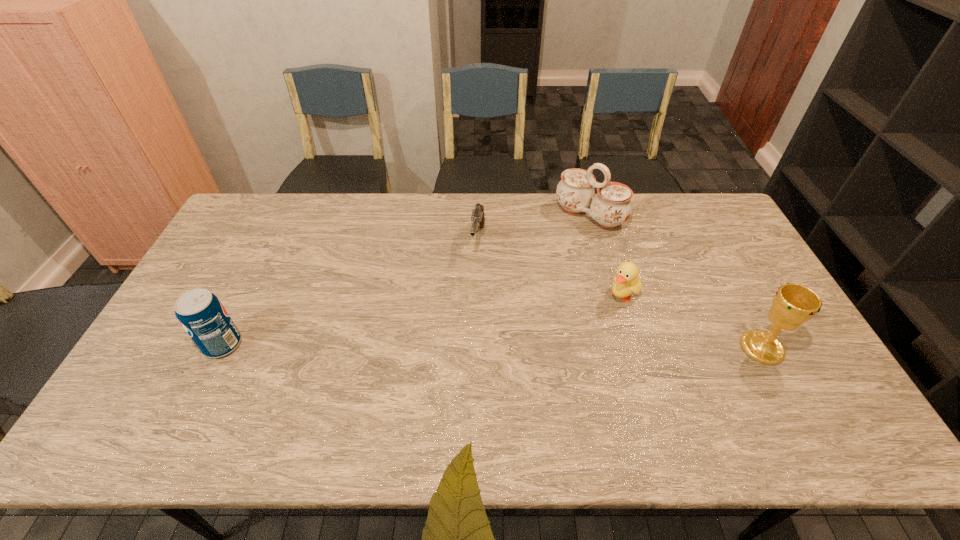
I want to click on free space located on the front-facing side of the third nearest object, so click(x=552, y=364).

Where is `free spot located by the handle of the chinaware`? The width and height of the screenshot is (960, 540). free spot located by the handle of the chinaware is located at coordinates (545, 260).

I want to click on free space located by the handle of the chinaware, so click(x=512, y=295).

Image resolution: width=960 pixels, height=540 pixels. I want to click on vacant space located 0.340m by the handle of the chinaware, so click(517, 289).

Locate an element on the screen. This screenshot has height=540, width=960. vacant space situated 0.100m at the barrel of the pistol is located at coordinates (473, 284).

Where is `free space located 0.190m at the barrel of the pistol`? This screenshot has height=540, width=960. free space located 0.190m at the barrel of the pistol is located at coordinates (468, 306).

At what (x,y) coordinates should I click in order to perform the action: click on free region located at the barrel of the pistol. Please return your answer as a coordinate pair (x, y). Image resolution: width=960 pixels, height=540 pixels. Looking at the image, I should click on (459, 361).

You are a GUI agent. You are given a task and a screenshot of the screen. Output one action in this format:
    pyautogui.click(x=<x>, y=<y>)
    Task: Click on the chinaware positioned at the far edge
    This screenshot has height=540, width=960.
    Given the screenshot: What is the action you would take?
    pyautogui.click(x=611, y=206)

Locate an element on the screen. pistol present at the far edge is located at coordinates (477, 217).

The height and width of the screenshot is (540, 960). I want to click on object positioned at the left edge, so click(202, 315).